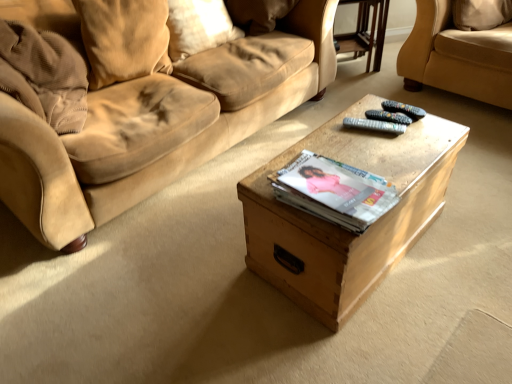
This screenshot has width=512, height=384. In order to click on unoccupied space behind black plastic remote at center, marked as the 1th remote in a bottom-to-top arrangement in this screenshot , I will do `click(368, 107)`.